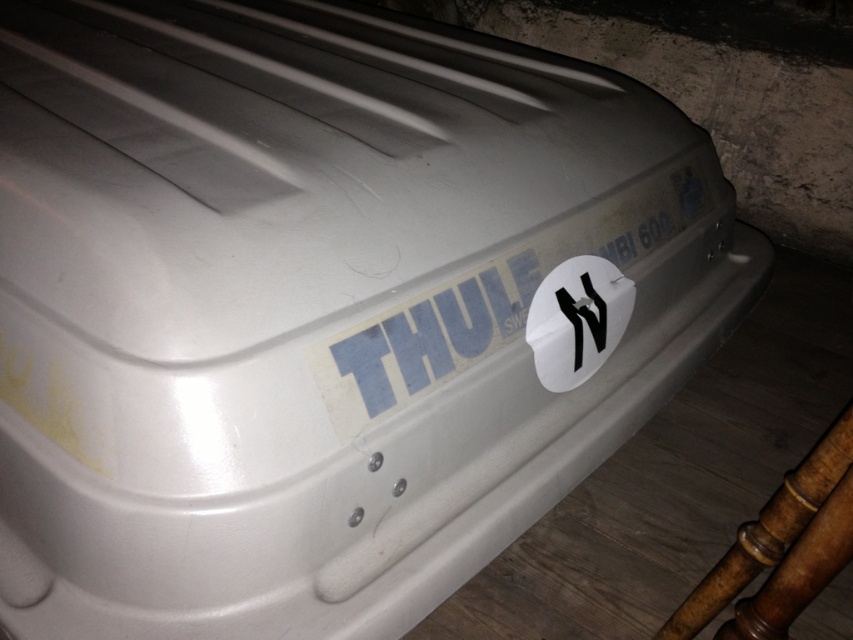
Can you confirm if brown wooden stool at lower right is positioned above white matte sticker at center?

Incorrect, brown wooden stool at lower right is not positioned above white matte sticker at center.

Locate an element on the screen. brown wooden stool at lower right is located at coordinates (780, 548).

You are a GUI agent. You are given a task and a screenshot of the screen. Output one action in this format:
    pyautogui.click(x=<x>, y=<y>)
    Task: Click on the brown wooden stool at lower right
    This screenshot has width=853, height=640.
    Given the screenshot: What is the action you would take?
    pyautogui.click(x=780, y=548)

Find the location of a particular element. brown wooden stool at lower right is located at coordinates (780, 548).